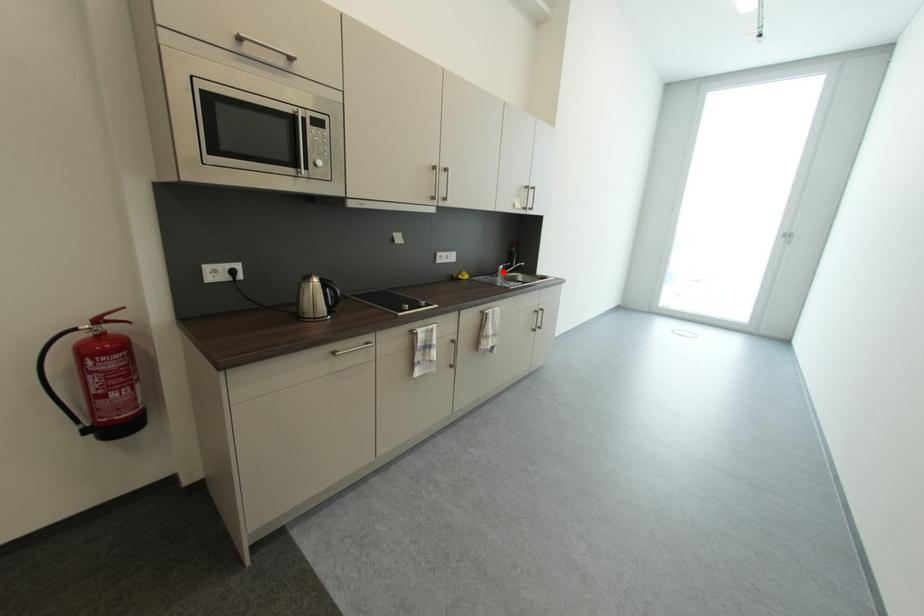
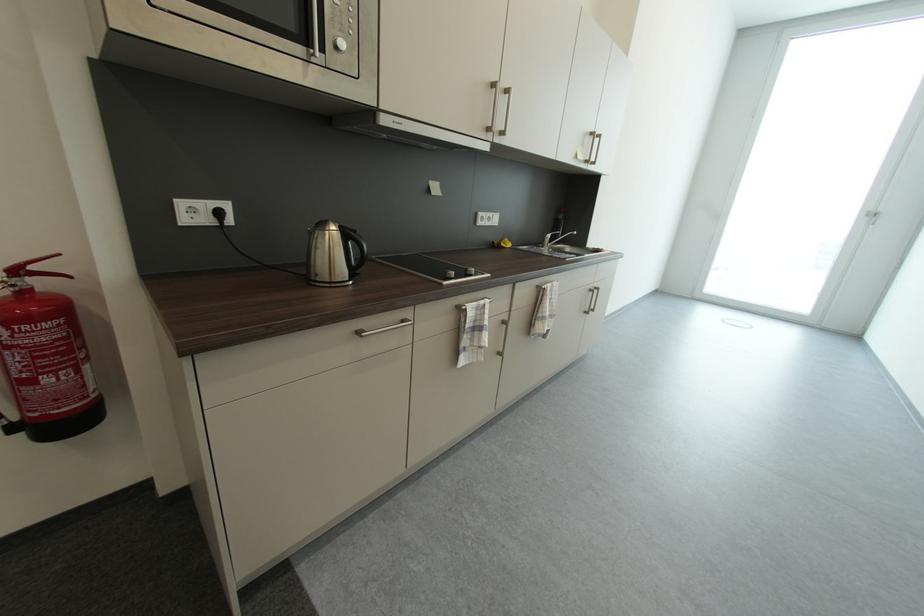
In the second image, find the point that corresponds to the highlighted location in the first image.

(550, 241)